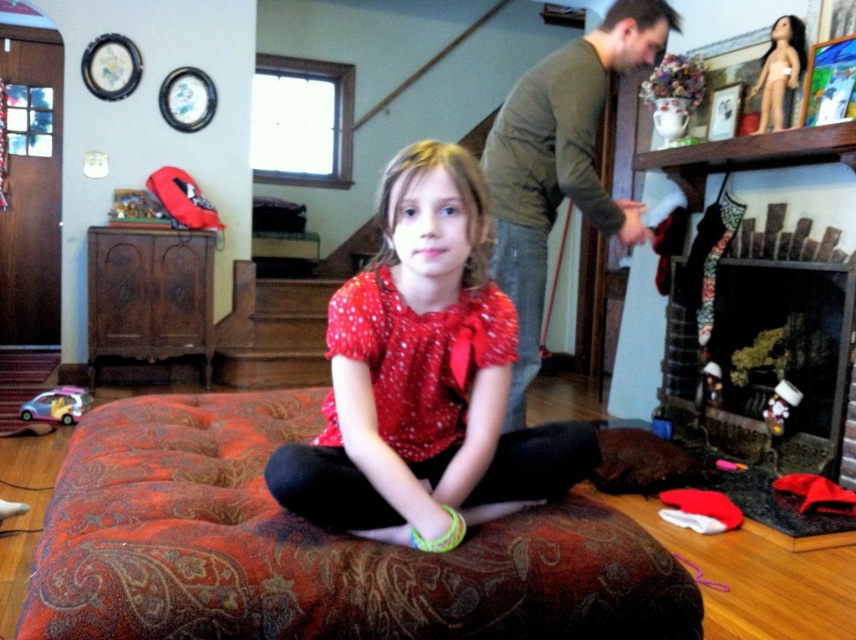
Question: Is matte red blouse at center wider than green cotton shirt at upper right?

Choices:
 (A) yes
 (B) no

Answer: (B)

Question: Does velvet-patterned dog bed at center have a greater width compared to black glass fireplace at lower right?

Choices:
 (A) no
 (B) yes

Answer: (B)

Question: Considering the real-world distances, which object is farthest from the green cotton shirt at upper right?

Choices:
 (A) matte red blouse at center
 (B) black glass fireplace at lower right

Answer: (B)

Question: Is matte red blouse at center thinner than black glass fireplace at lower right?

Choices:
 (A) no
 (B) yes

Answer: (A)

Question: Which of the following is the closest to the observer?

Choices:
 (A) (723, 416)
 (B) (592, 60)

Answer: (B)

Question: Which object is farther from the camera taking this photo?

Choices:
 (A) velvet-patterned dog bed at center
 (B) matte red blouse at center

Answer: (B)